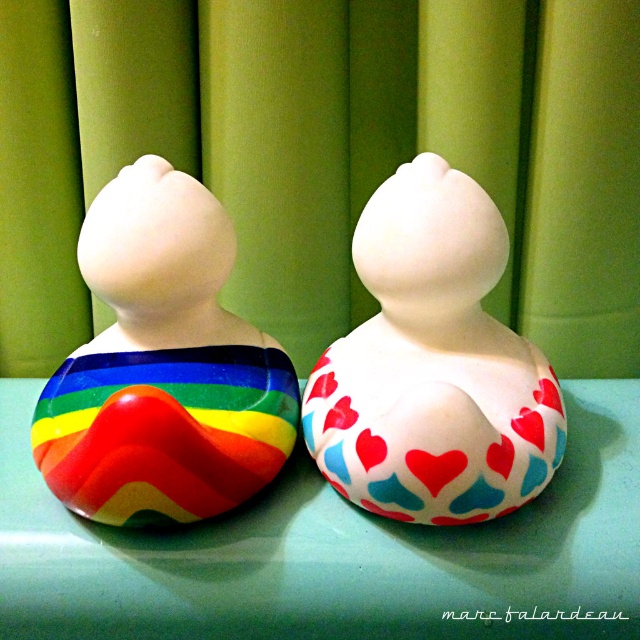
Identify the location of matte white rubber duck at center. The height and width of the screenshot is (640, 640). (433, 365).

Between point (456, 388) and point (58, 432), which one is positioned behind?

Point (58, 432)

Describe the element at coordinates (433, 365) in the screenshot. I see `matte white rubber duck at center` at that location.

Where is `matte white rubber duck at center`? matte white rubber duck at center is located at coordinates (433, 365).

Does point (440, 556) come closer to viewer compared to point (468, 488)?

No, it is behind (468, 488).

Between green glossy table at center and matte white rubber duck at center, which one has less height?

Standing shorter between the two is green glossy table at center.

Does point (403, 584) come in front of point (317, 432)?

Yes, point (403, 584) is in front of point (317, 432).

Identify the location of green glossy table at center. The image size is (640, 640). (333, 552).

Between green glossy table at center and rainbow glossy rubber duck at left, which one has more height?

Standing taller between the two is rainbow glossy rubber duck at left.

Who is more forward, (x=529, y=538) or (x=186, y=396)?

Point (x=529, y=538) is more forward.

Identify the location of green glossy table at center. Image resolution: width=640 pixels, height=640 pixels. (333, 552).